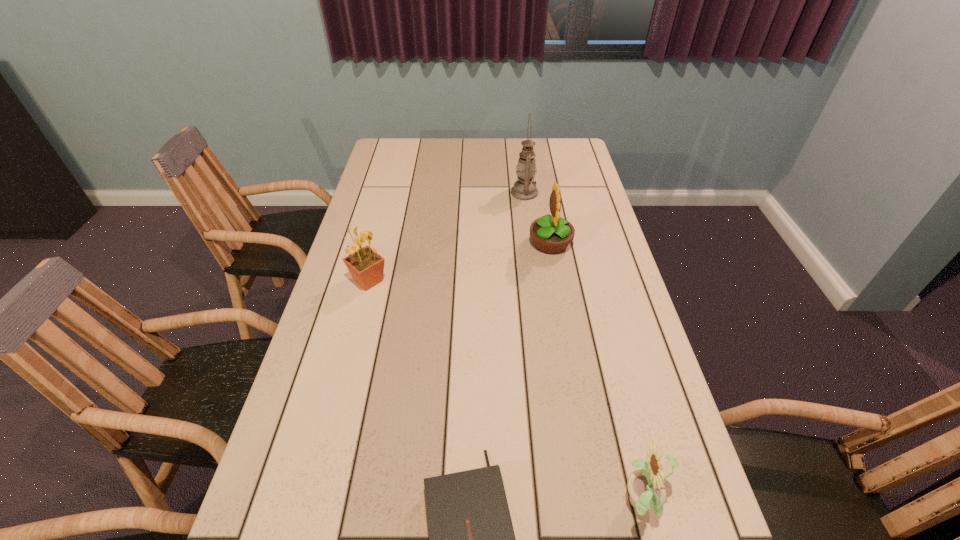
Locate an element on the screen. blank space located 0.240m at the front of the second farthest sunflower with flowers visible is located at coordinates (470, 281).

Image resolution: width=960 pixels, height=540 pixels. In order to click on vacant area situated 0.060m on the front-facing side of the nearest sunflower in this screenshot , I will do coord(588,504).

Find the location of a particular element. The height and width of the screenshot is (540, 960). free point located 0.260m on the front-facing side of the nearest sunflower is located at coordinates (485, 504).

Locate an element on the screen. free space located on the front-facing side of the nearest sunflower is located at coordinates pos(479,504).

At what (x,y) coordinates should I click in order to perform the action: click on object at the left edge. Please return your answer as a coordinate pair (x, y). Looking at the image, I should click on (366, 266).

Find the location of `vacant area at the far edge`. vacant area at the far edge is located at coordinates (492, 143).

I want to click on vacant space at the left edge of the desktop, so click(382, 298).

Locate an element on the screen. vacant area at the right edge of the desktop is located at coordinates (623, 413).

Identify the location of free space between the farthest sunflower and the oil lamp. The height and width of the screenshot is (540, 960). (538, 218).

The width and height of the screenshot is (960, 540). I want to click on vacant area between the nearest sunflower and the second farthest object, so click(596, 374).